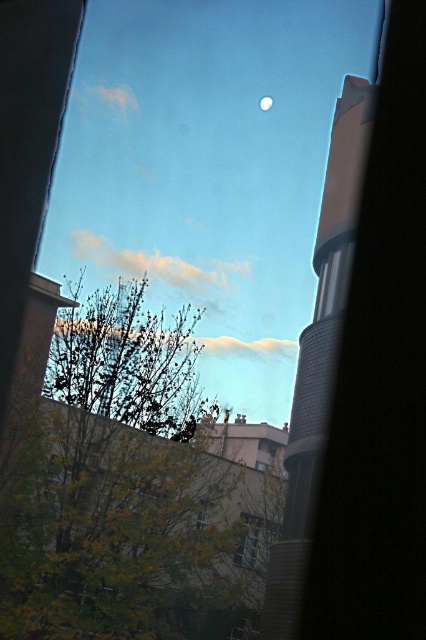
You are an architect designing a new building and want to ensure that the white glossy moon at upper center is visible from the transparent glass window at center. Based on the scene description, is the moon visible through the window?

The transparent glass window at center is below the white glossy moon at upper center, so the moon is above the window. Therefore, the white glossy moon at upper center would be visible through the transparent glass window at center as it is positioned above it.

You are standing in front of the window frame and want to touch the point at coordinates point (77, 298). Can you reach it with your hand?

The point (77, 298) is 2.21 meters from camera, so you cannot reach it with your hand as it is too far away.

You are an architect designing a new building and want to ensure the transparent glass window at center doesn not block the view of the white glossy moon at upper center. Based on the scene description, can you determine if the window is tall enough to allow the moon to be seen from inside?

The transparent glass window at center is much taller than the white glossy moon at upper center, so the window is tall enough to allow the white glossy moon at upper center to be seen from inside.